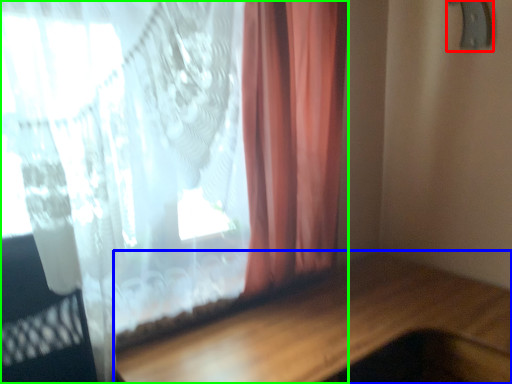
Question: Which object is the closest to the door handle (highlighted by a red box)? Choose among these: table (highlighted by a blue box) or curtain (highlighted by a green box).

Choices:
 (A) table
 (B) curtain

Answer: (B)